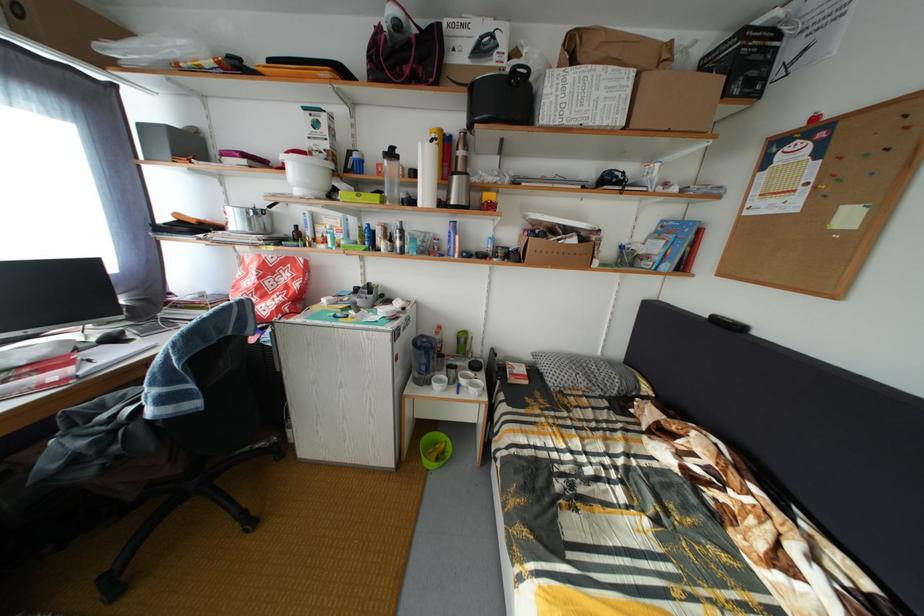
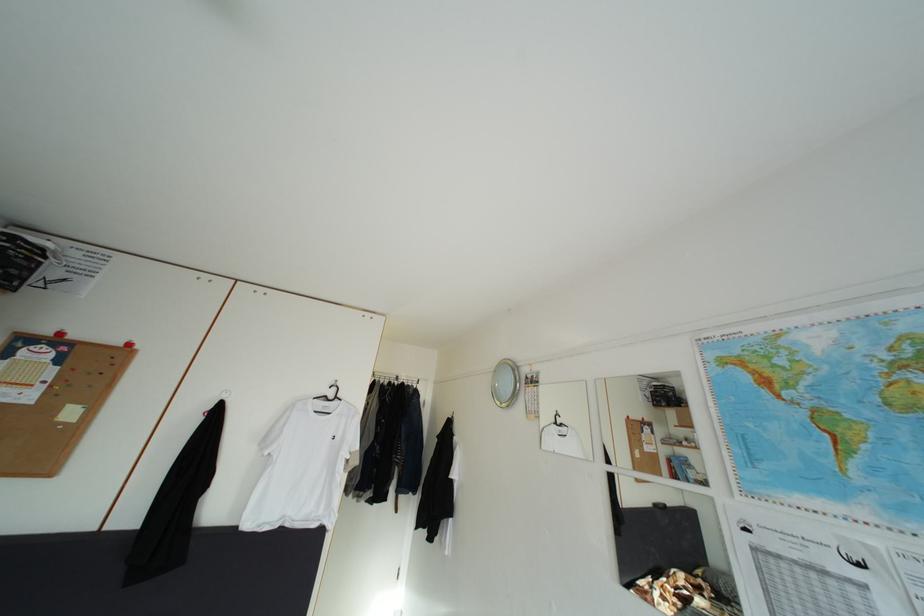
Question: The camera is either moving clockwise (left) or counter-clockwise (right) around the object. The first image is from the beginning of the video and the second image is from the end. Is the camera moving left or right when shooting the video?

Choices:
 (A) Left
 (B) Right

Answer: (A)